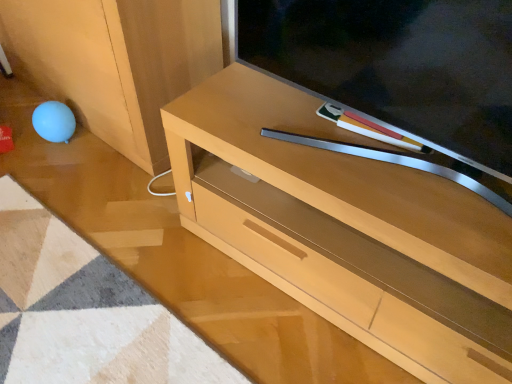
Question: From a real-world perspective, is light wood cabinet at lower right positioned above or below matte wood television at center?

Choices:
 (A) above
 (B) below

Answer: (B)

Question: Would you say light wood cabinet at lower right is inside or outside matte wood television at center?

Choices:
 (A) inside
 (B) outside

Answer: (B)

Question: Which of these objects is positioned closest to the matte wood television at center?

Choices:
 (A) light brown wood tv stand at center
 (B) light wood cabinet at lower right

Answer: (A)

Question: Based on their relative distances, which object is nearer to the light brown wood tv stand at center?

Choices:
 (A) light wood cabinet at lower right
 (B) matte wood television at center

Answer: (B)